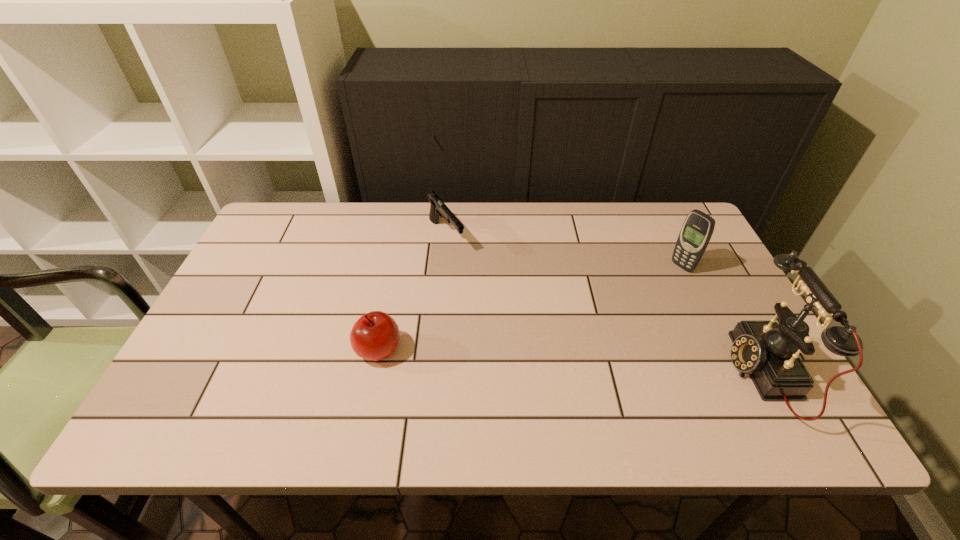
At what (x,y) coordinates should I click in order to perform the action: click on blank space that satisfies the following two spatial constraints: 1. on the front side of the third nearest object; 2. on the dial of the telephone. Please return your answer as a coordinate pair (x, y). Looking at the image, I should click on (733, 373).

Find the location of a particular element. Image resolution: width=960 pixels, height=540 pixels. free location that satisfies the following two spatial constraints: 1. on the front side of the farthest object; 2. on the left side of the third shortest object is located at coordinates (444, 266).

Find the location of a particular element. This screenshot has width=960, height=540. vacant point that satisfies the following two spatial constraints: 1. on the front side of the third object from right to left; 2. on the dial of the telephone is located at coordinates coord(434,373).

Identify the location of free space that satisfies the following two spatial constraints: 1. on the front side of the leftmost object; 2. on the dial of the telephone. point(374,373).

In order to click on free location that satisfies the following two spatial constraints: 1. on the front side of the gun; 2. on the left side of the second tallest object in this screenshot , I will do `click(444, 266)`.

Locate an element on the screen. free space that satisfies the following two spatial constraints: 1. on the back side of the third shortest object; 2. on the right side of the leftmost object is located at coordinates (396, 266).